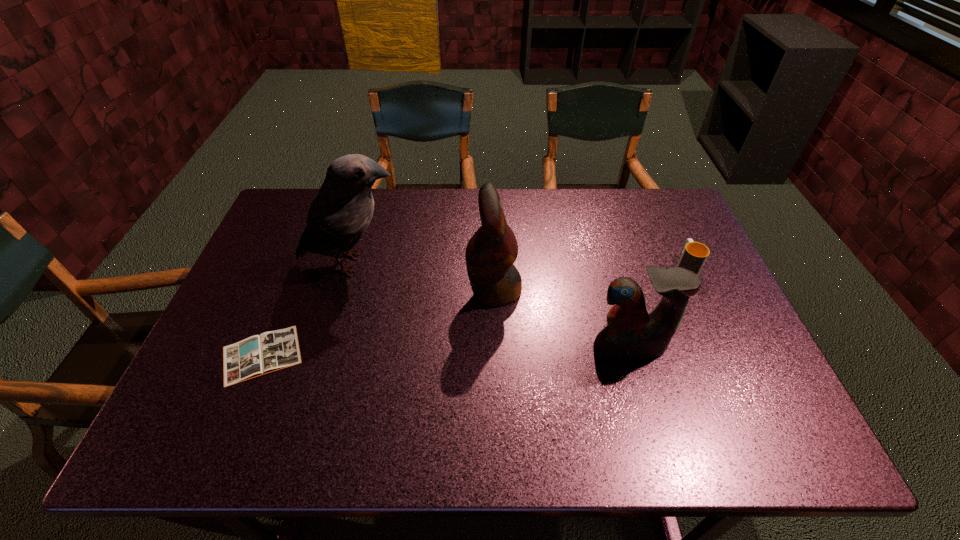
You are a GUI agent. You are given a task and a screenshot of the screen. Output one action in this format:
    pyautogui.click(x=<x>, y=<y>)
    Task: Click on the vacant area located 0.390m on the face of the second parrot from right to left
    Image resolution: width=960 pixels, height=540 pixels.
    Given the screenshot: What is the action you would take?
    pyautogui.click(x=325, y=290)

What are the coordinates of `blank space located at the face of the fourth object from left to right` in the screenshot? It's located at (638, 381).

Image resolution: width=960 pixels, height=540 pixels. In order to click on free location located 0.280m with the handle on the side of the second shortest object in this screenshot , I will do `click(655, 199)`.

Locate an element on the screen. The image size is (960, 540). vacant area situated with the handle on the side of the second shortest object is located at coordinates (657, 202).

Find the location of `free location located with the handle on the side of the second shortest object`. free location located with the handle on the side of the second shortest object is located at coordinates (674, 239).

Find the location of a particular element. The height and width of the screenshot is (540, 960). free region located on the right of the shortest object is located at coordinates (382, 355).

Find the location of a particular element. parrot that is at the left edge is located at coordinates (341, 211).

Where is `book present at the left edge`? Image resolution: width=960 pixels, height=540 pixels. book present at the left edge is located at coordinates (257, 355).

Locate an element on the screen. The image size is (960, 540). object situated at the right edge is located at coordinates (694, 254).

Image resolution: width=960 pixels, height=540 pixels. Identify the location of blank space at the far edge of the desktop. (636, 227).